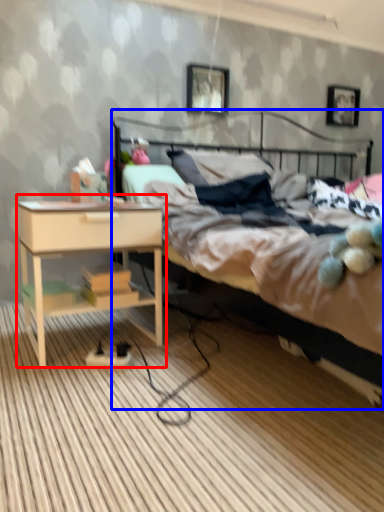
Question: Among these objects, which one is nearest to the camera, nightstand (highlighted by a red box) or bed (highlighted by a blue box)?

Choices:
 (A) nightstand
 (B) bed

Answer: (B)